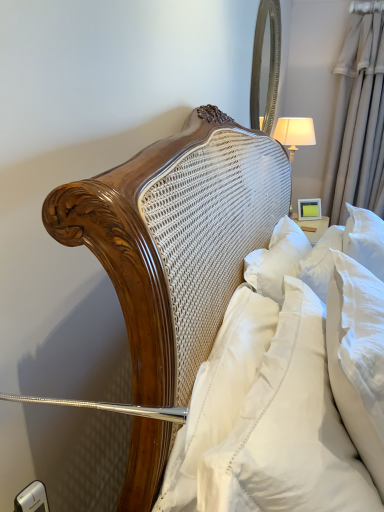
Question: Is silver/metallic mirror at upper right wider than white satin pillow at center, the first pillow in the back-to-front sequence?

Choices:
 (A) yes
 (B) no

Answer: (A)

Question: Considering the relative positions of silver/metallic mirror at upper right and white satin pillow at center, the first pillow in the back-to-front sequence, in the image provided, is silver/metallic mirror at upper right in front of white satin pillow at center, the first pillow in the back-to-front sequence,?

Choices:
 (A) yes
 (B) no

Answer: (B)

Question: Does silver/metallic mirror at upper right have a greater height compared to white satin pillow at center, the first pillow in the back-to-front sequence?

Choices:
 (A) yes
 (B) no

Answer: (A)

Question: Can you confirm if silver/metallic mirror at upper right is positioned to the left of white satin pillow at center, which ranks as the third pillow in front-to-back order?

Choices:
 (A) no
 (B) yes

Answer: (A)

Question: Is the surface of silver/metallic mirror at upper right in direct contact with white satin pillow at center, which ranks as the third pillow in front-to-back order?

Choices:
 (A) yes
 (B) no

Answer: (B)

Question: Considering the relative positions of silver/metallic mirror at upper right and white satin pillow at center, the first pillow in the back-to-front sequence, in the image provided, is silver/metallic mirror at upper right to the right of white satin pillow at center, the first pillow in the back-to-front sequence, from the viewer's perspective?

Choices:
 (A) no
 (B) yes

Answer: (B)

Question: From the image's perspective, is silver/metallic mirror at upper right on top of silky beige curtain at right?

Choices:
 (A) yes
 (B) no

Answer: (A)

Question: Is silver/metallic mirror at upper right bigger than silky beige curtain at right?

Choices:
 (A) no
 (B) yes

Answer: (A)

Question: Is silver/metallic mirror at upper right positioned far away from silky beige curtain at right?

Choices:
 (A) yes
 (B) no

Answer: (B)

Question: Is silver/metallic mirror at upper right at the right side of silky beige curtain at right?

Choices:
 (A) no
 (B) yes

Answer: (A)

Question: Could you tell me if silver/metallic mirror at upper right is turned towards silky beige curtain at right?

Choices:
 (A) yes
 (B) no

Answer: (B)

Question: Can you confirm if silver/metallic mirror at upper right is shorter than silky beige curtain at right?

Choices:
 (A) no
 (B) yes

Answer: (B)

Question: Is white fabric lampshade at upper right at the back of white satin pillow at center, the first pillow in the back-to-front sequence?

Choices:
 (A) yes
 (B) no

Answer: (B)